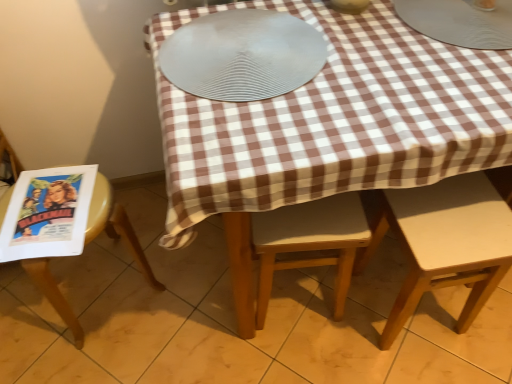
The image size is (512, 384). In order to click on free point above yellow plastic chair at left, acting as the first chair starting from the left (from a real-world perspective) in this screenshot , I will do `click(49, 209)`.